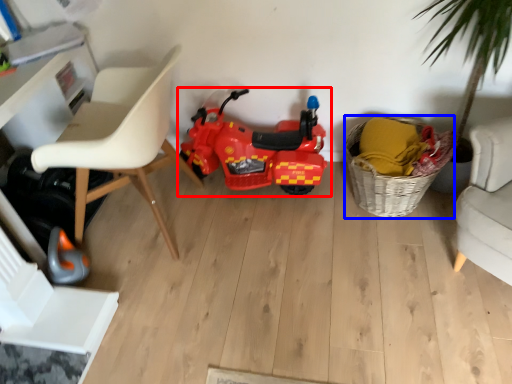
Question: Which of the following is the farthest to the observer, land vehicle (highlighted by a red box) or basket (highlighted by a blue box)?

Choices:
 (A) land vehicle
 (B) basket

Answer: (A)